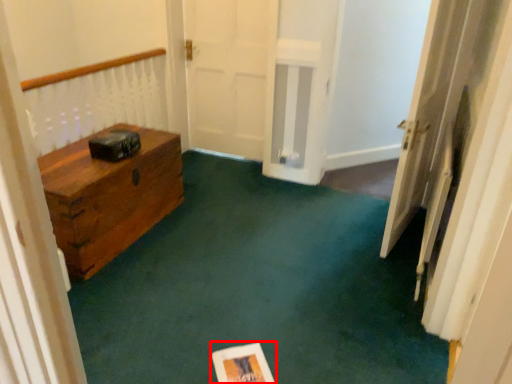
Question: From the image's perspective, what is the correct spatial positioning of copy (annotated by the red box) in reference to door?

Choices:
 (A) below
 (B) above

Answer: (A)